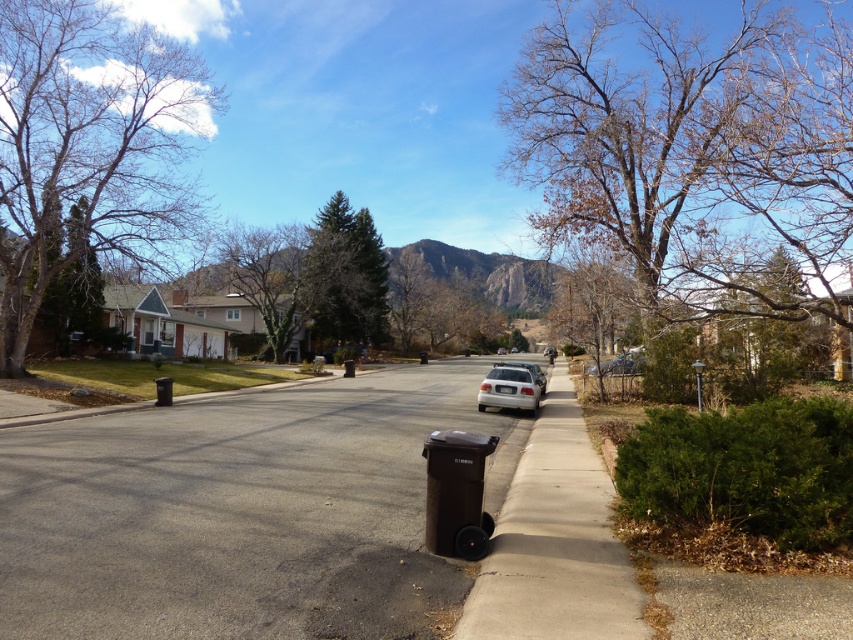
Question: Considering the real-world distances, which object is farthest from the brown concrete curb at lower center?

Choices:
 (A) green leafy tree at center
 (B) green matte tree at center

Answer: (B)

Question: Can you confirm if dark gray asphalt at center is wider than brown leafless tree at left?

Choices:
 (A) yes
 (B) no

Answer: (A)

Question: Does green leafy tree at center appear under satin silver sedan at center-right?

Choices:
 (A) yes
 (B) no

Answer: (B)

Question: Which point is farther from the camera taking this photo?

Choices:
 (A) (508, 385)
 (B) (543, 406)
 (C) (538, 369)
 (D) (273, 253)

Answer: (D)

Question: Which of the following is the farthest from the observer?

Choices:
 (A) satin silver sedan at center
 (B) bare wood tree at right

Answer: (A)

Question: Does green matte tree at center have a lesser width compared to satin silver sedan at center?

Choices:
 (A) yes
 (B) no

Answer: (B)